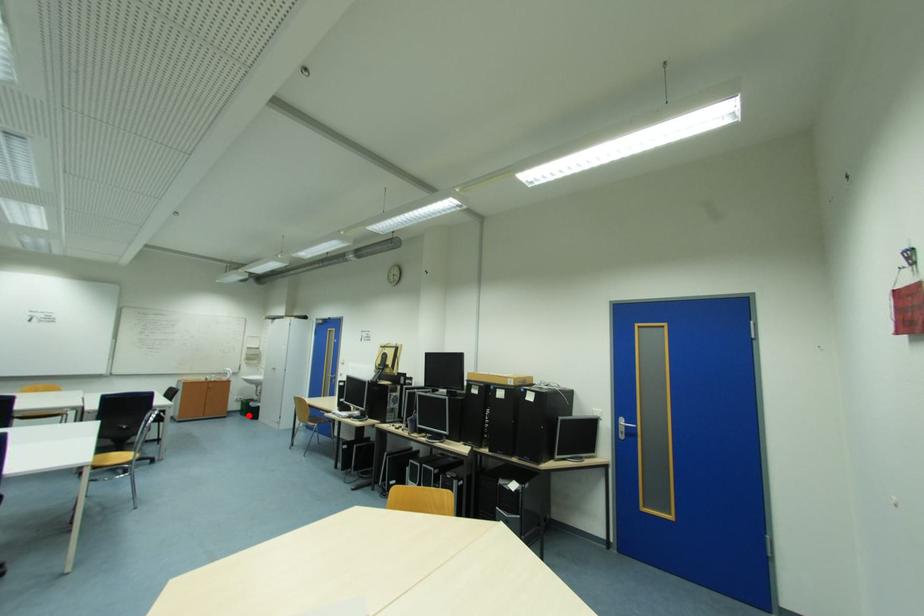
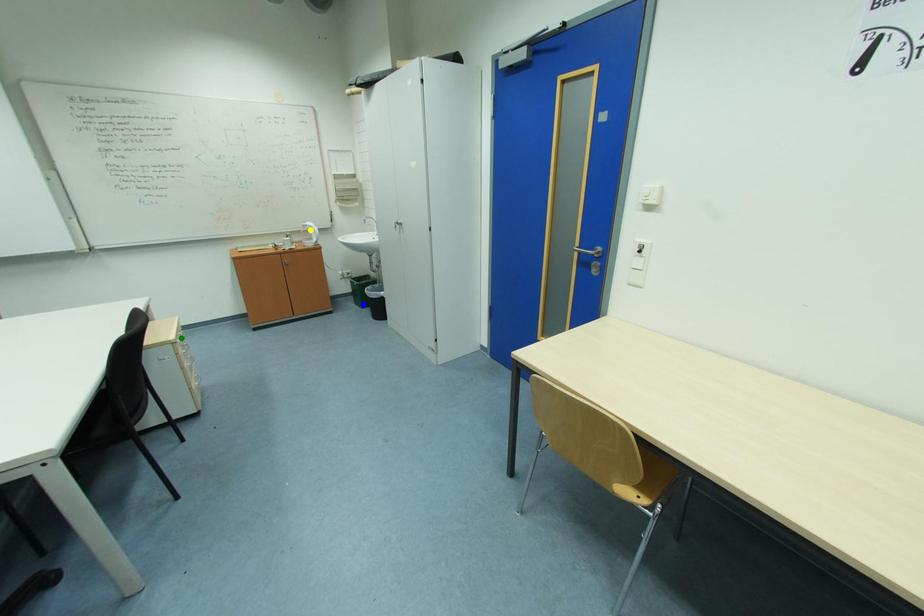
Question: I am providing you with two images of the same scene from different viewpoints. A red point is marked on the first image. You are given multiple points on the second image. Which spot in image 2 lines up with the point in image 1?

Choices:
 (A) green point
 (B) blue point
 (C) yellow point

Answer: (B)